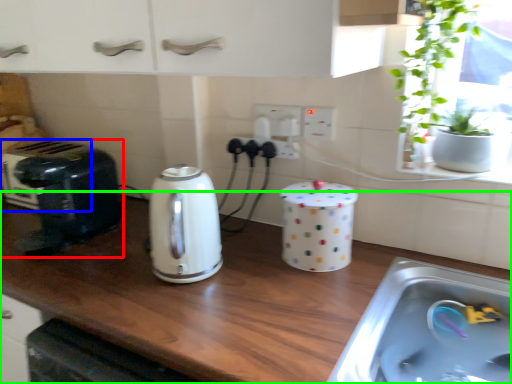
Question: Based on their relative distances, which object is farther from toaster (highlighted by a red box)? Choose from appliance (highlighted by a blue box) and countertop (highlighted by a green box).

Choices:
 (A) appliance
 (B) countertop

Answer: (B)